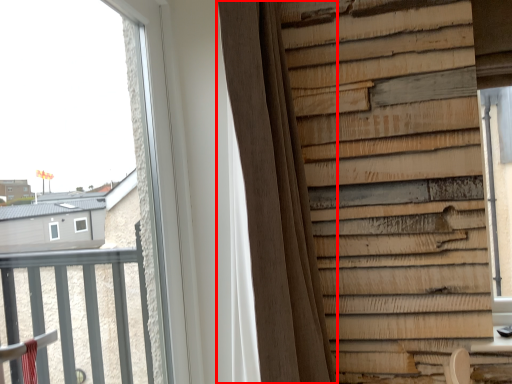
Question: From the image's perspective, where is curtain (annotated by the red box) located in relation to window in the image?

Choices:
 (A) below
 (B) above

Answer: (A)